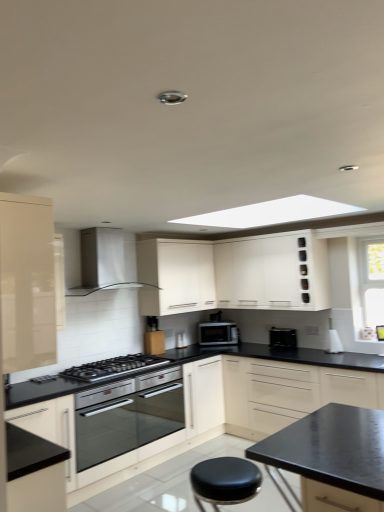
Find the location of a particular element. vacant region below black matte toaster at lower center (from a real-world perspective) is located at coordinates (290, 346).